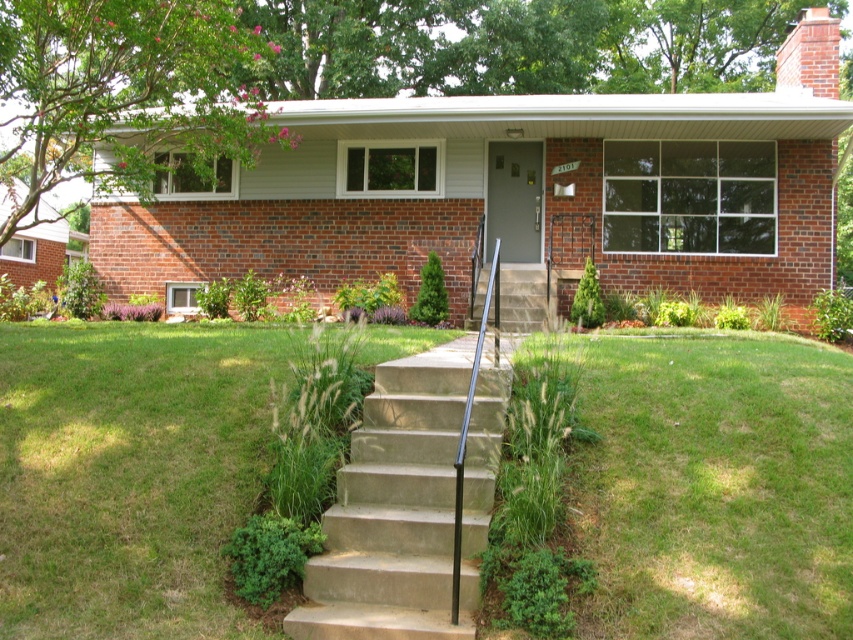
You are standing at the entrance of the suburban house and want to place a decorative pot between the two points labeled point (621,540) and point (439,540). Based on their positions, which point should the pot be closer to if it needs to be placed in front of the house?

The pot should be closer to point (621,540) because it is in front of point (439,540).

You are standing at the front door of the suburban house and want to place a small potted plant exactly at the position where the green grass at lower center is located. According to the image, what are the coordinates of the spot where you should place the potted plant?

The coordinates for the position of the green grass at lower center are given as point (712, 486). Therefore, you should place the potted plant at coordinates (712, 486).